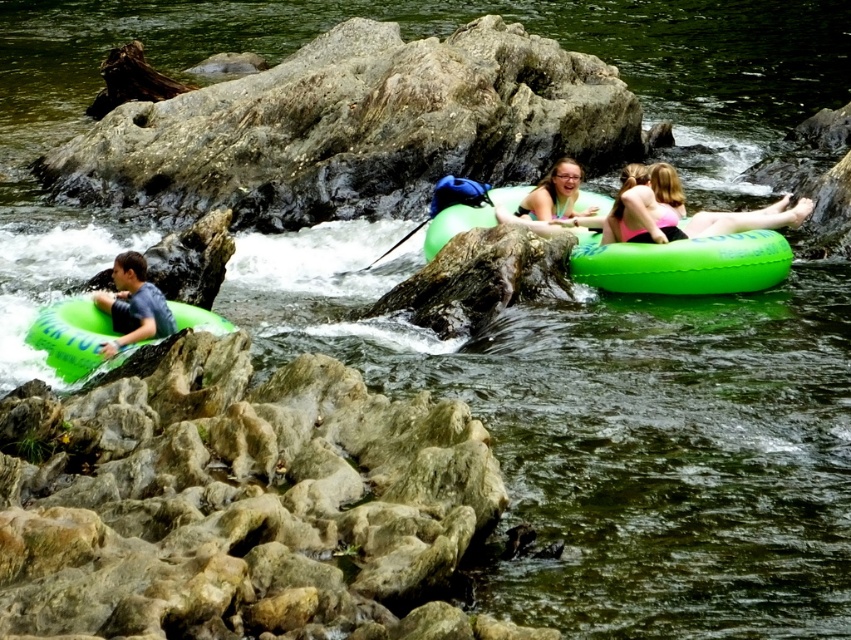
You are navigating a small drone over the river and need to land it precisely on the matte green tube at left. What are the coordinates where you should aim the drone?

The coordinates for the matte green tube at left are at point (133, 305).

You are navigating a rocky river and see the green rubber raft at center and the green rubber tube at left. Which one is positioned to the right side of the other?

The green rubber raft at center is to the right of the green rubber tube at left, so the raft is positioned to the right side of the tube.

You are standing on the riverbank and see the matte green tube at left floating downstream. If you want to reach it before it goes over the small waterfall 50 meters away, can you make it if you run at 6 meters per second?

The distance between you and the matte green tube at left is 44.46 meters. If you run at 6 meters per second, you can cover the distance in about 7.41 seconds. Since the waterfall is 50 meters away, which is farther than 44.46 meters, you would reach the tube before it reaches the waterfall.